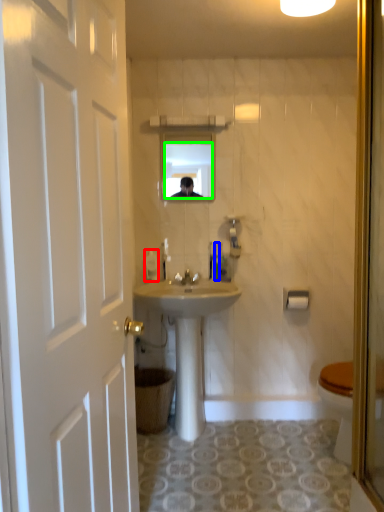
Question: Which is farther away from toiletries (highlighted by a red box)? toiletries (highlighted by a blue box) or mirror (highlighted by a green box)?

Choices:
 (A) toiletries
 (B) mirror

Answer: (B)